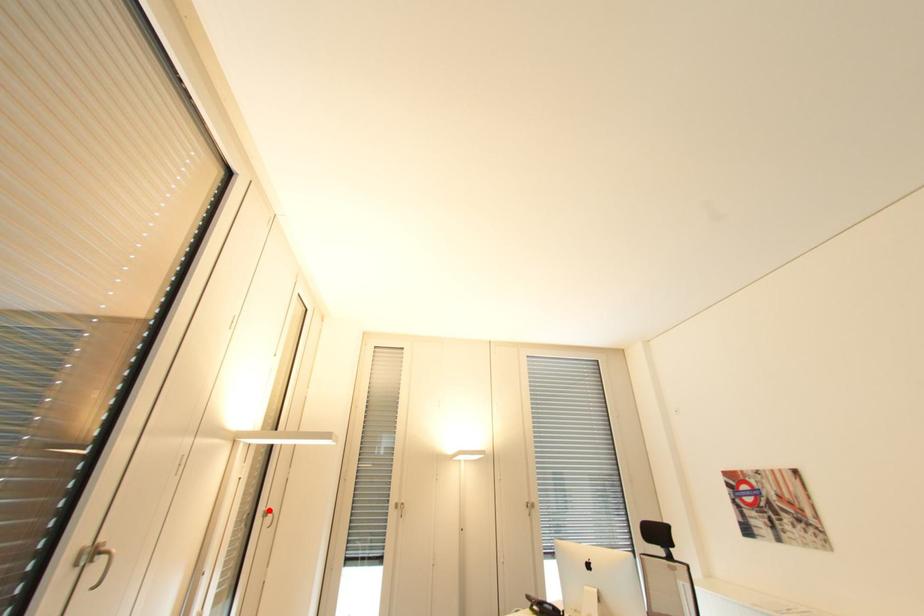
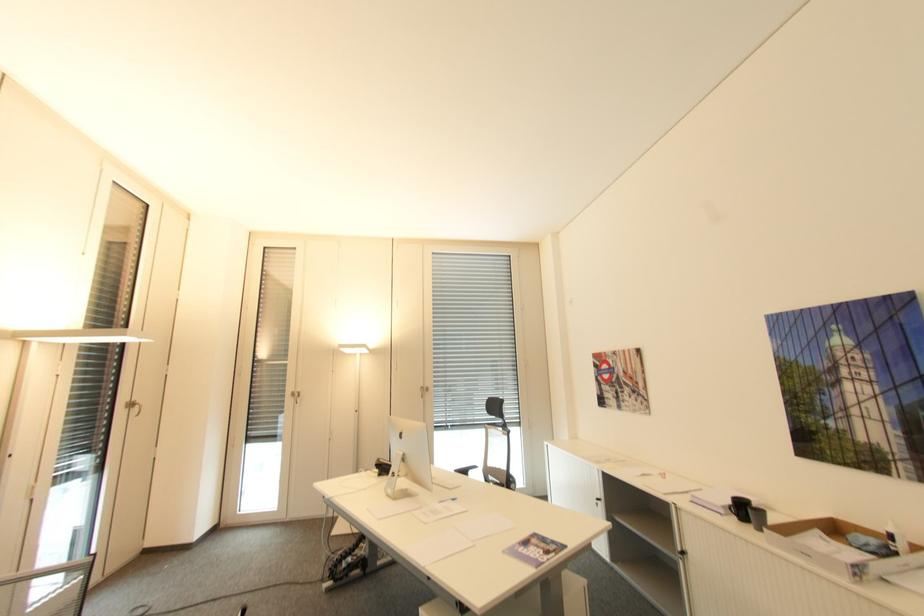
Where in the second image is the point corresponding to the highlighted location from the first image?

(131, 402)